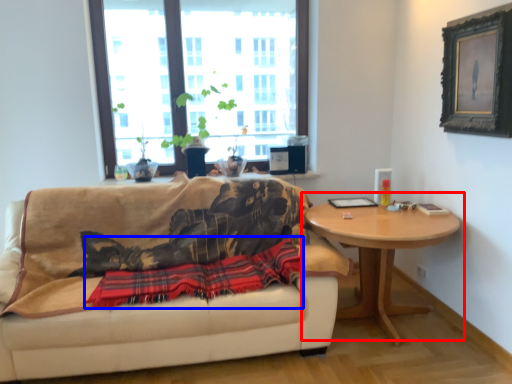
Question: Which object appears farthest to the camera in this image, coffee table (highlighted by a red box) or plaid (highlighted by a blue box)?

Choices:
 (A) coffee table
 (B) plaid

Answer: (A)